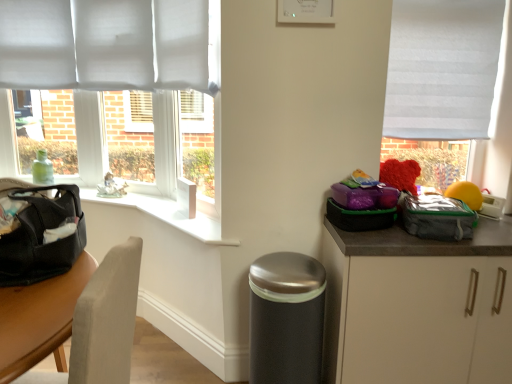
Question: Is matte black bag at left bigger than satin silver trash can at lower center?

Choices:
 (A) yes
 (B) no

Answer: (B)

Question: From the image's perspective, would you say matte black bag at left is positioned over satin silver trash can at lower center?

Choices:
 (A) yes
 (B) no

Answer: (A)

Question: Is there a large distance between matte black bag at left and satin silver trash can at lower center?

Choices:
 (A) no
 (B) yes

Answer: (A)

Question: Is matte black bag at left wider than satin silver trash can at lower center?

Choices:
 (A) no
 (B) yes

Answer: (A)

Question: Does matte black bag at left appear on the right side of satin silver trash can at lower center?

Choices:
 (A) no
 (B) yes

Answer: (A)

Question: Considering the relative sizes of matte black bag at left and satin silver trash can at lower center in the image provided, is matte black bag at left shorter than satin silver trash can at lower center?

Choices:
 (A) yes
 (B) no

Answer: (A)

Question: Does white fabric window at right have a smaller size compared to matte black bag at left?

Choices:
 (A) yes
 (B) no

Answer: (B)

Question: Is white fabric window at right completely or partially outside of matte black bag at left?

Choices:
 (A) yes
 (B) no

Answer: (A)

Question: Is the depth of white fabric window at right greater than that of matte black bag at left?

Choices:
 (A) no
 (B) yes

Answer: (B)

Question: Is white fabric window at right at the right side of matte black bag at left?

Choices:
 (A) no
 (B) yes

Answer: (B)

Question: Is white fabric window at right taller than matte black bag at left?

Choices:
 (A) yes
 (B) no

Answer: (A)

Question: Could you tell me if white fabric window at right is facing matte black bag at left?

Choices:
 (A) yes
 (B) no

Answer: (B)

Question: Can you confirm if matte black bag at left is wider than gray fabric lunch bag at right?

Choices:
 (A) no
 (B) yes

Answer: (B)